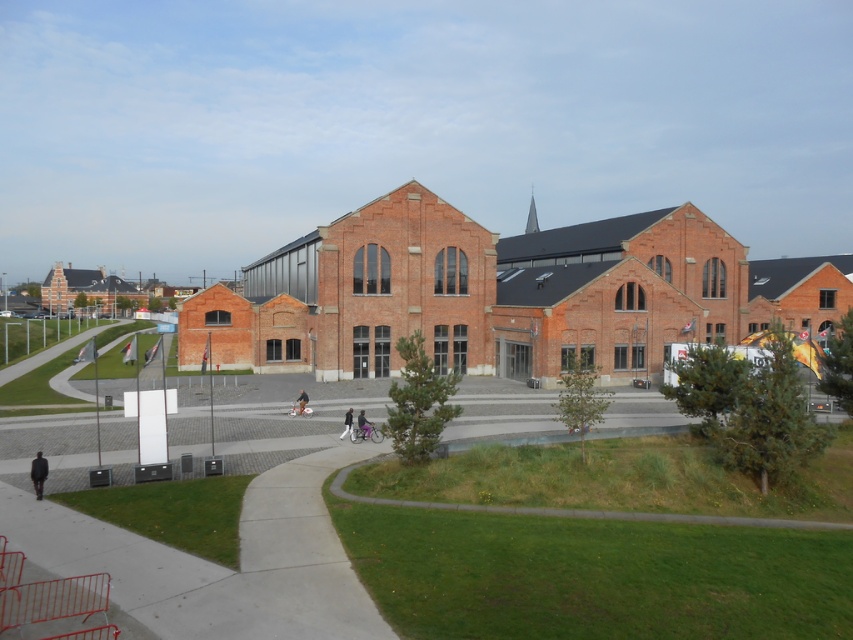
Question: Does dark gray jacket at lower left lie behind dark blue jeans at center?

Choices:
 (A) yes
 (B) no

Answer: (B)

Question: Which point is closer to the camera taking this photo?

Choices:
 (A) (345, 432)
 (B) (714, 307)
 (C) (357, 420)

Answer: (C)

Question: Considering the relative positions of dark blue jeans at center and black matte person at center in the image provided, where is dark blue jeans at center located with respect to black matte person at center?

Choices:
 (A) right
 (B) left

Answer: (A)

Question: Among these objects, which one is farthest from the camera?

Choices:
 (A) dark gray fabric pants at center
 (B) dark blue jeans at center
 (C) dark gray jacket at lower left
 (D) black matte person at center

Answer: (D)

Question: Can you confirm if dark gray jacket at lower left is bigger than dark gray fabric pants at center?

Choices:
 (A) no
 (B) yes

Answer: (A)

Question: Which point is farther to the camera?

Choices:
 (A) (300, 412)
 (B) (33, 480)
 (C) (352, 410)
 (D) (358, 426)

Answer: (C)